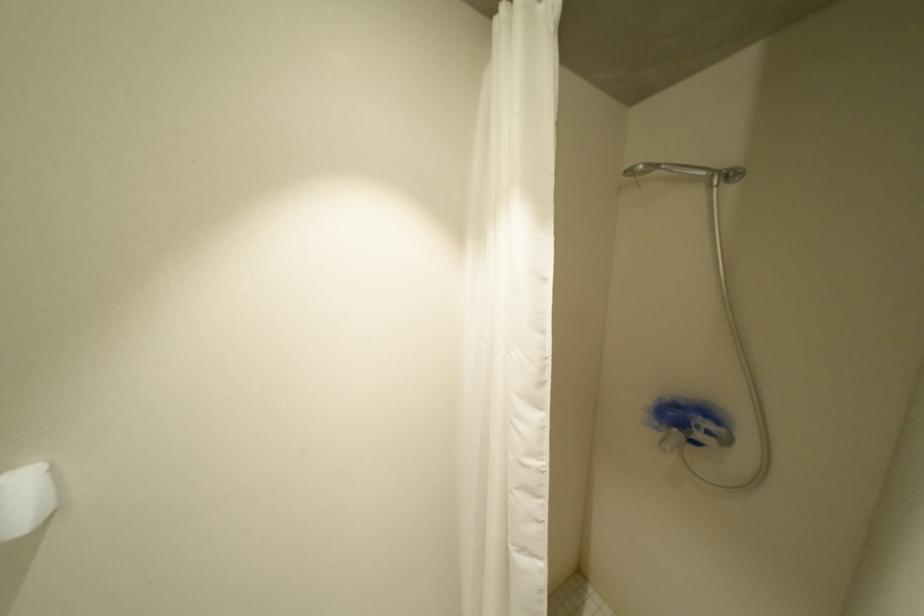
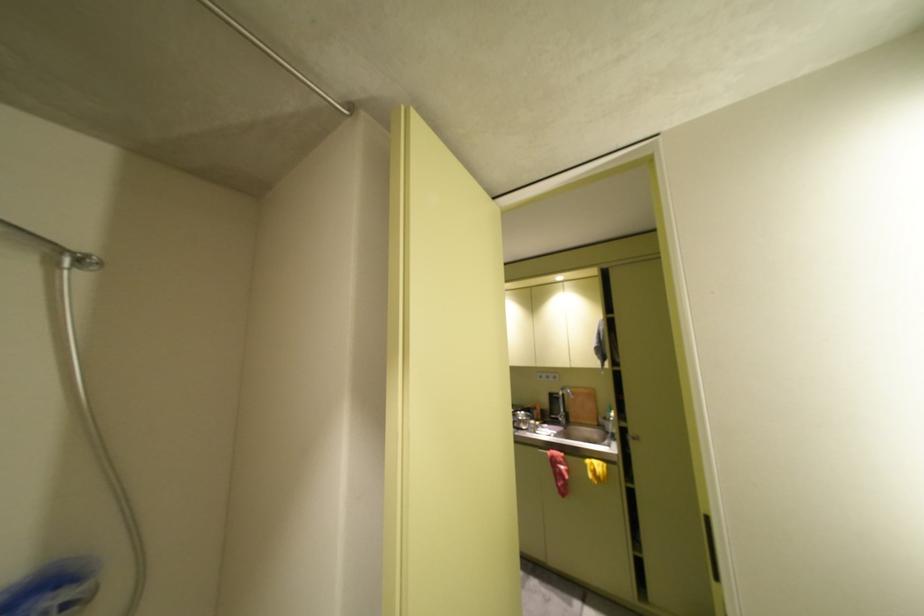
Question: Based on the continuous images, in which direction is the camera rotating? Reply with the corresponding letter.

Choices:
 (A) Left
 (B) Right
 (C) Up
 (D) Down

Answer: (B)